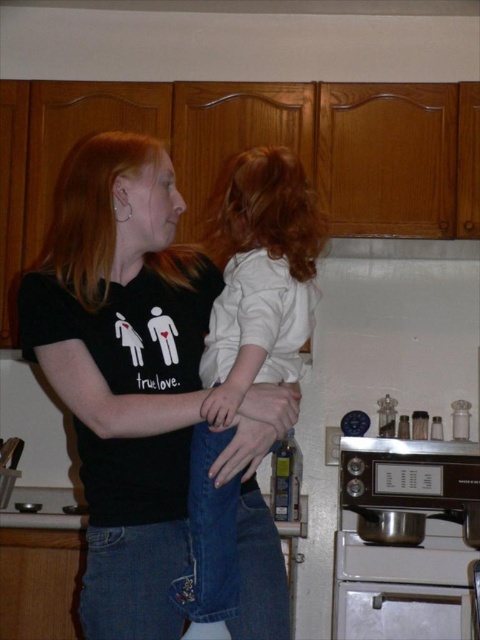
Between black matte t-shirt at center and white soft shirt at center, which one has more height?

With more height is black matte t-shirt at center.

Which is above, black matte t-shirt at center or white soft shirt at center?

white soft shirt at center

Based on the photo, who is more distant from viewer, [90,237] or [223,314]?

Positioned behind is point [90,237].

You are a GUI agent. You are given a task and a screenshot of the screen. Output one action in this format:
    pyautogui.click(x=<x>, y=<y>)
    Task: Click on the black matte t-shirt at center
    
    Given the screenshot: What is the action you would take?
    pyautogui.click(x=123, y=369)